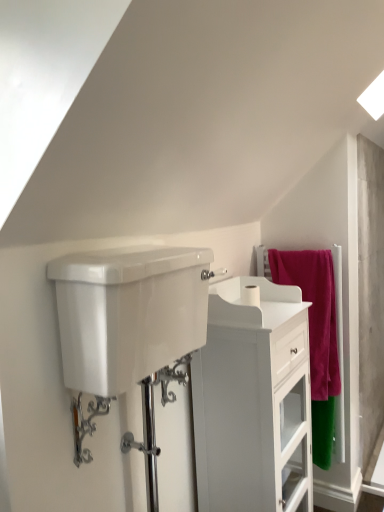
Question: From a real-world perspective, is white glossy tank at center below white glossy cabinet at center?

Choices:
 (A) yes
 (B) no

Answer: (B)

Question: Is white glossy tank at center to the right of white glossy cabinet at center from the viewer's perspective?

Choices:
 (A) no
 (B) yes

Answer: (A)

Question: Would you say white glossy tank at center is outside white glossy cabinet at center?

Choices:
 (A) yes
 (B) no

Answer: (A)

Question: Is white glossy tank at center shorter than white glossy cabinet at center?

Choices:
 (A) yes
 (B) no

Answer: (A)

Question: From the image's perspective, is white glossy tank at center under white glossy cabinet at center?

Choices:
 (A) no
 (B) yes

Answer: (A)

Question: Is white glossy tank at center positioned before white glossy cabinet at center?

Choices:
 (A) no
 (B) yes

Answer: (B)

Question: Can you confirm if chrome metallic faucet at lower left is taller than white matte toilet paper at center?

Choices:
 (A) no
 (B) yes

Answer: (B)

Question: Would you say white matte toilet paper at center is part of chrome metallic faucet at lower left's contents?

Choices:
 (A) yes
 (B) no

Answer: (B)

Question: From a real-world perspective, is chrome metallic faucet at lower left over white matte toilet paper at center?

Choices:
 (A) yes
 (B) no

Answer: (B)

Question: Is chrome metallic faucet at lower left aimed at white matte toilet paper at center?

Choices:
 (A) yes
 (B) no

Answer: (B)

Question: Is chrome metallic faucet at lower left positioned in front of white matte toilet paper at center?

Choices:
 (A) no
 (B) yes

Answer: (B)

Question: Is chrome metallic faucet at lower left further to the viewer compared to white matte toilet paper at center?

Choices:
 (A) no
 (B) yes

Answer: (A)

Question: Does pink fabric towel at right have a greater width compared to concrete screen door at right?

Choices:
 (A) no
 (B) yes

Answer: (B)